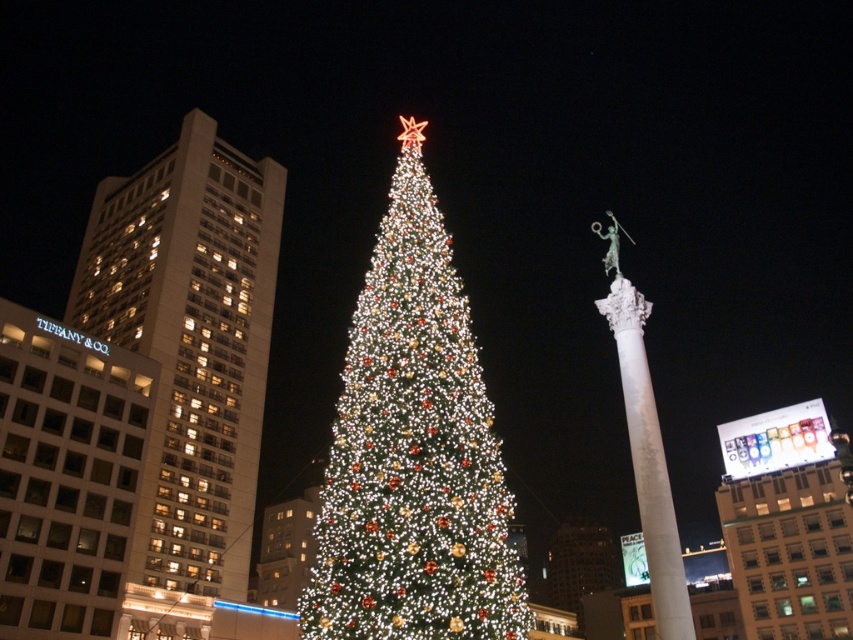
Who is more forward, (370, 314) or (631, 413)?

Positioned in front is point (370, 314).

Can you confirm if illuminated green christmas tree at center is taller than white marble column at center-right?

Correct, illuminated green christmas tree at center is much taller as white marble column at center-right.

Image resolution: width=853 pixels, height=640 pixels. Find the location of `illuminated green christmas tree at center`. illuminated green christmas tree at center is located at coordinates (413, 452).